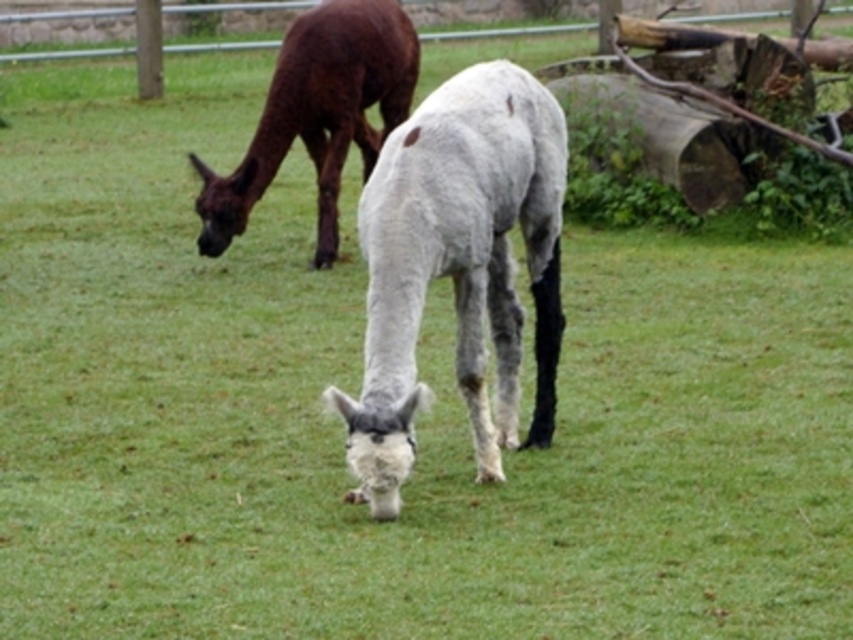
Question: Does white woolen alpaca at center appear on the right side of brown woolen alpaca at upper left?

Choices:
 (A) no
 (B) yes

Answer: (B)

Question: Can you confirm if white woolen alpaca at center is positioned below brown woolen alpaca at upper left?

Choices:
 (A) yes
 (B) no

Answer: (A)

Question: Which of the following is the farthest from the observer?

Choices:
 (A) (482, 406)
 (B) (340, 1)

Answer: (B)

Question: Can you confirm if white woolen alpaca at center is thinner than brown woolen alpaca at upper left?

Choices:
 (A) yes
 (B) no

Answer: (A)

Question: Which of the following is the farthest from the observer?

Choices:
 (A) (300, 29)
 (B) (410, 321)

Answer: (A)